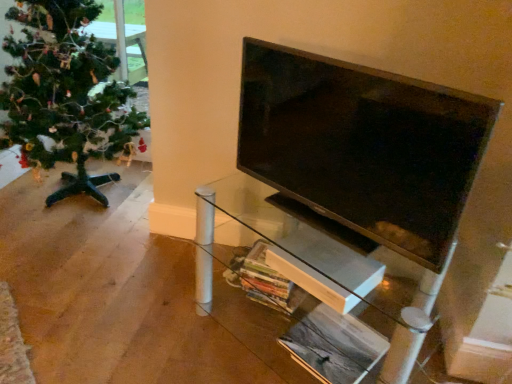
Question: From their relative heights in the image, would you say transparent glass tv stand at center is taller or shorter than green matte christmas tree at left?

Choices:
 (A) short
 (B) tall

Answer: (A)

Question: Would you say transparent glass tv stand at center is inside or outside green matte christmas tree at left?

Choices:
 (A) inside
 (B) outside

Answer: (B)

Question: Estimate the real-world distances between objects in this image. Which object is farther from the matte black tv at center?

Choices:
 (A) transparent glass tv stand at center
 (B) green matte christmas tree at left

Answer: (B)

Question: Considering the real-world distances, which object is closest to the transparent glass tv stand at center?

Choices:
 (A) matte black tv at center
 (B) green matte christmas tree at left

Answer: (A)